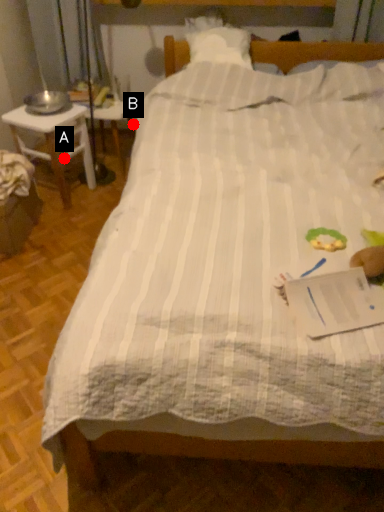
Question: Two points are circled on the image, labeled by A and B beside each circle. Which point appears closest to the camera in this image?

Choices:
 (A) A is closer
 (B) B is closer

Answer: (B)